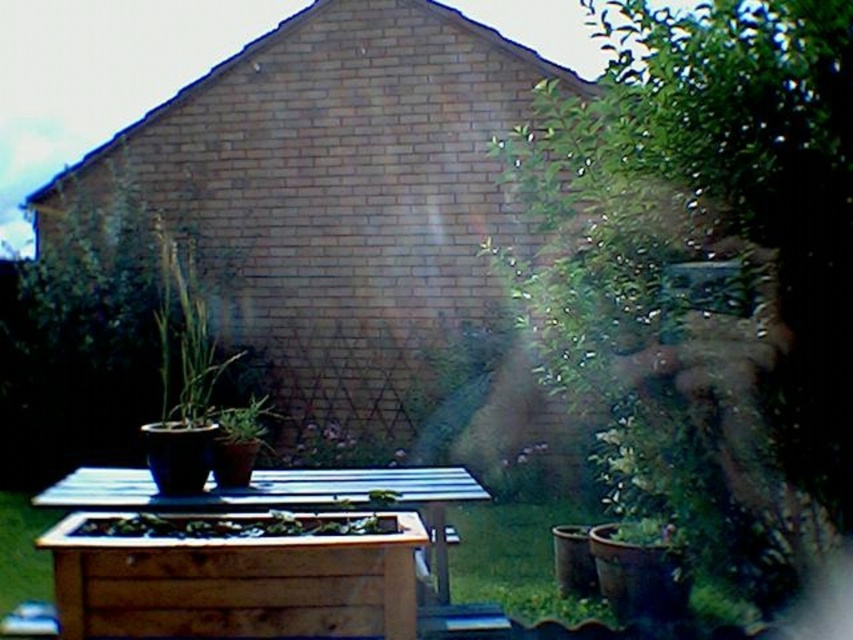
Question: Does wooden planter at lower center appear over wooden planter at center?

Choices:
 (A) no
 (B) yes

Answer: (B)

Question: Among these objects, which one is nearest to the camera?

Choices:
 (A) wooden planter at center
 (B) wooden planter at lower center

Answer: (B)

Question: Considering the relative positions of wooden planter at lower center and wooden planter at center in the image provided, where is wooden planter at lower center located with respect to wooden planter at center?

Choices:
 (A) above
 (B) below

Answer: (A)

Question: Which point is closer to the camera?

Choices:
 (A) wooden planter at center
 (B) wooden planter at lower center

Answer: (B)

Question: Does wooden planter at lower center appear on the left side of wooden planter at center?

Choices:
 (A) no
 (B) yes

Answer: (B)